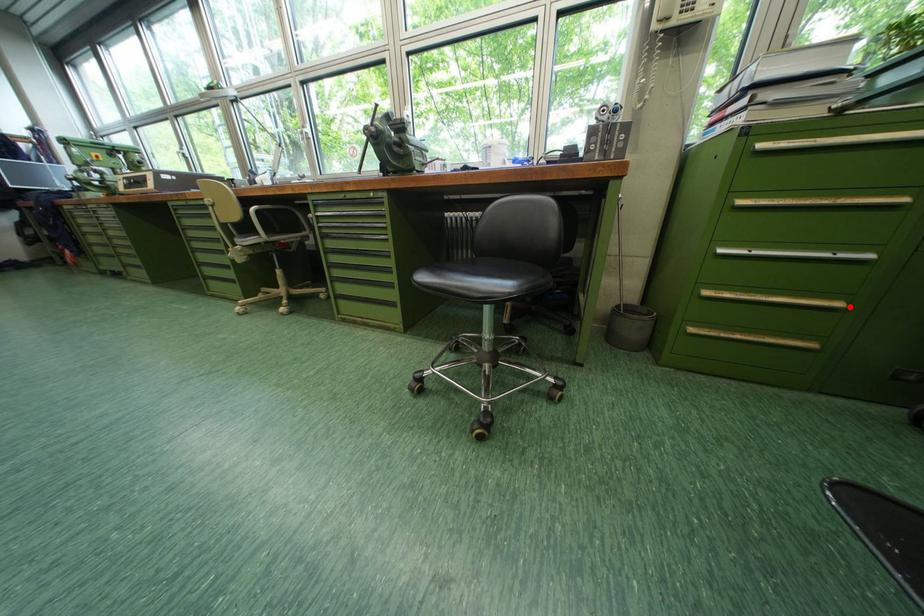
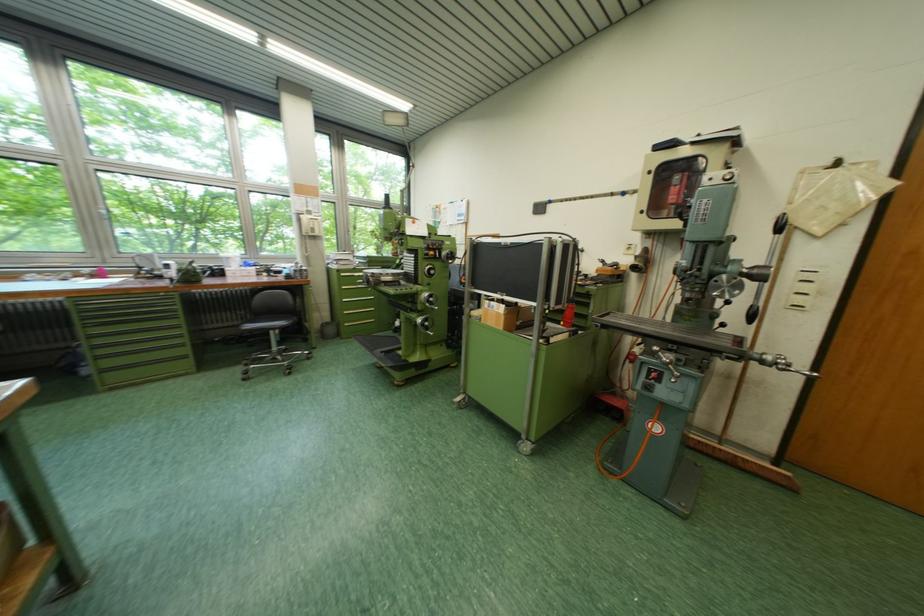
Question: A red point is marked in image1. In image2, is the corresponding 3D point closer to the camera or farther? Reply with the corresponding letter.

Choices:
 (A) The corresponding 3D point is closer.
 (B) The corresponding 3D point is farther.

Answer: (B)